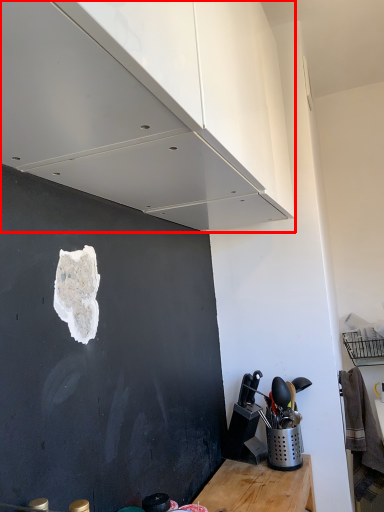
Question: From the image, what is the correct spatial relationship of cabinetry (annotated by the red box) in relation to appliance?

Choices:
 (A) right
 (B) left

Answer: (B)